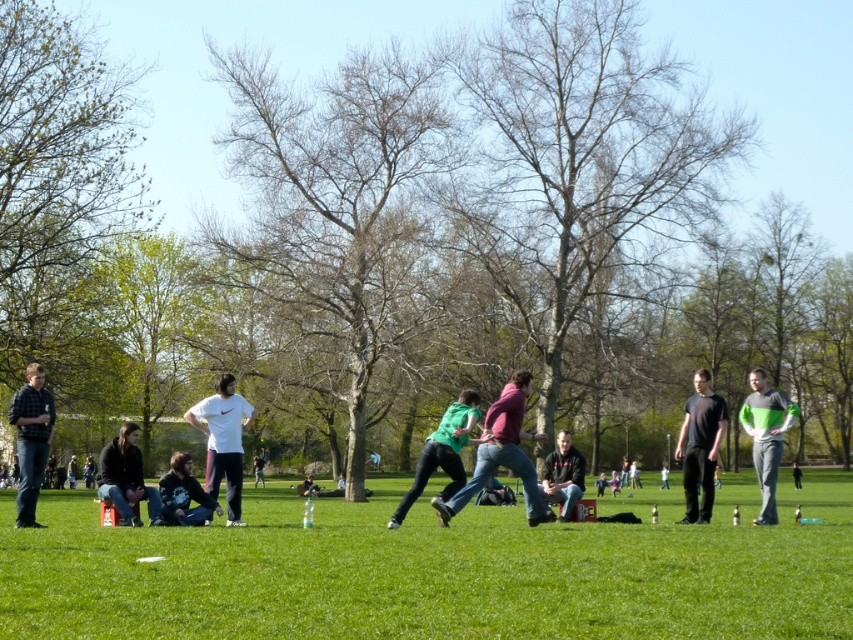
You are a photographer wanting to capture both the green fabric shirt at center and the dark gray jacket at lower left in a single photo. Considering their heights, which one should you focus on to ensure both are fully visible in the frame?

The green fabric shirt at center is much taller than the dark gray jacket at lower left, so focusing on the taller object will ensure both are visible.

You are standing in the park and see two people at the center wearing the green fabric shirt at center and the dark gray sweater at center. Which one is higher up in the image?

The green fabric shirt at center is located above the dark gray sweater at center in the image.